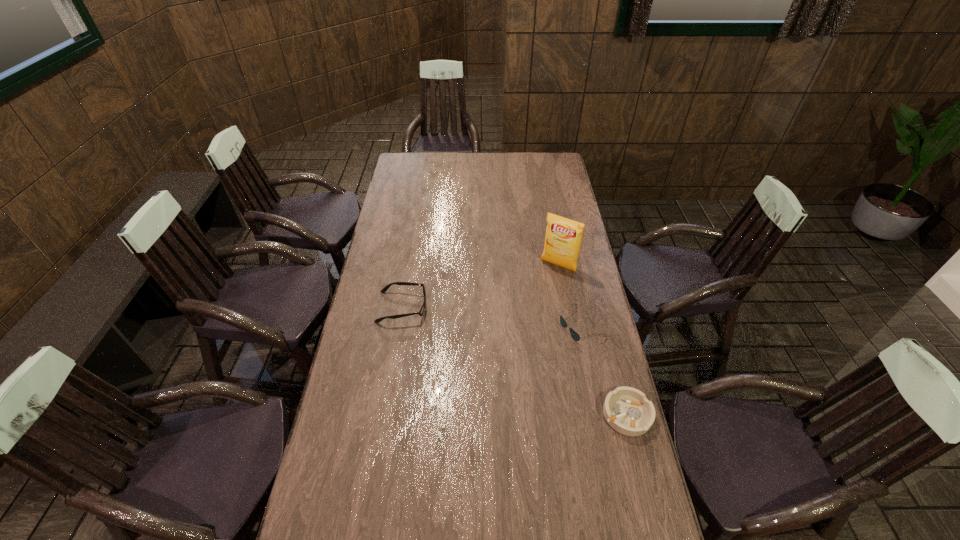
Locate an element on the screen. The width and height of the screenshot is (960, 540). the leftmost object is located at coordinates (385, 288).

Identify the location of the nearest object. (627, 410).

The width and height of the screenshot is (960, 540). Identify the location of sunglasses. [x=575, y=335].

Locate an element on the screen. The image size is (960, 540). the farthest object is located at coordinates (563, 237).

Identify the location of crisp (potato chip). The width and height of the screenshot is (960, 540). (563, 237).

Locate an element on the screen. vacant region located on the front-facing side of the leftmost object is located at coordinates (528, 307).

In order to click on vacant area situated on the left of the nearest object in this screenshot , I will do `click(536, 414)`.

Locate an element on the screen. This screenshot has width=960, height=540. free space located 0.220m on the lenses of the sunglasses is located at coordinates (512, 360).

The height and width of the screenshot is (540, 960). I want to click on vacant space positioned 0.170m on the lenses of the sunglasses, so click(x=523, y=354).

At what (x,y) coordinates should I click in order to perform the action: click on free space located 0.170m on the lenses of the sunglasses. Please return your answer as a coordinate pair (x, y). Image resolution: width=960 pixels, height=540 pixels. Looking at the image, I should click on (523, 354).